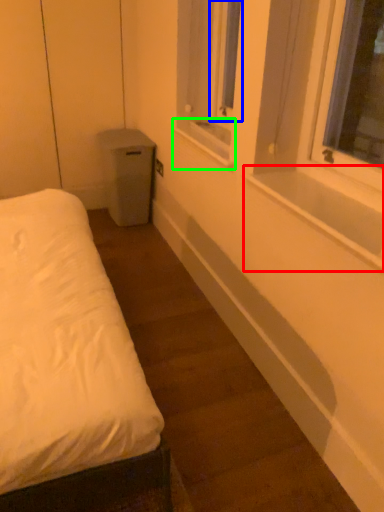
Question: Which object is positioned closest to window sill (highlighted by a red box)? Select from window screen (highlighted by a blue box) and window sill (highlighted by a green box).

Choices:
 (A) window screen
 (B) window sill

Answer: (B)